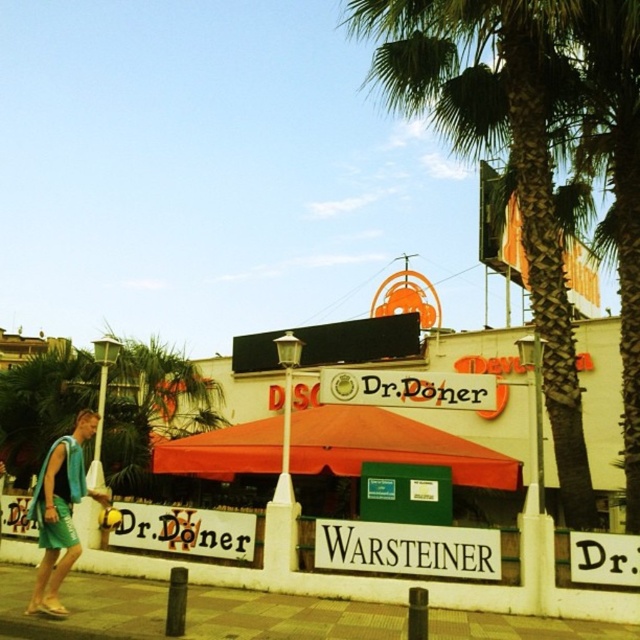
You are a customer approaching the Dr.Dokter establishment and see the brown brick pavement at lower center and the green fabric towel at lower left. Which object is positioned to the right of the other?

The brown brick pavement at lower center is to the right of the green fabric towel at lower left.